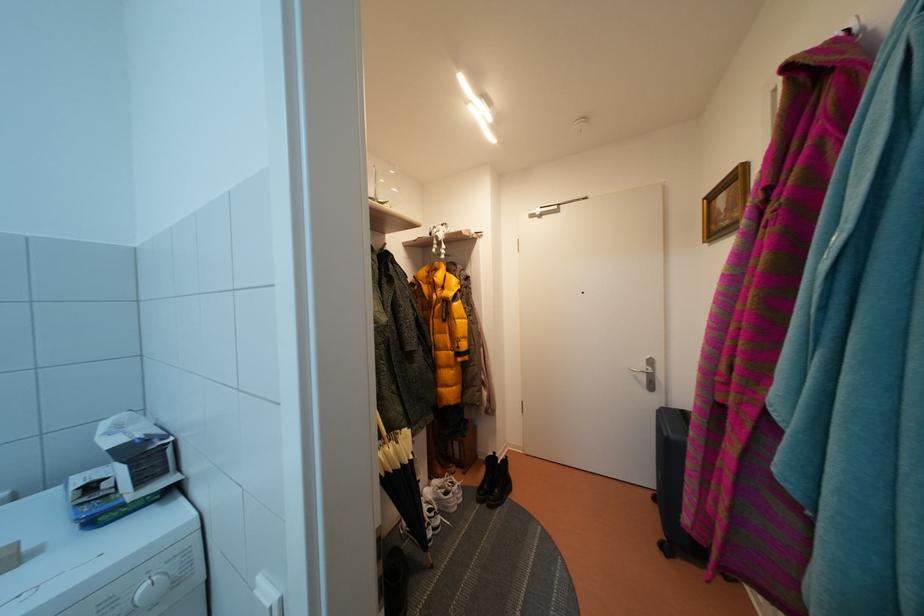
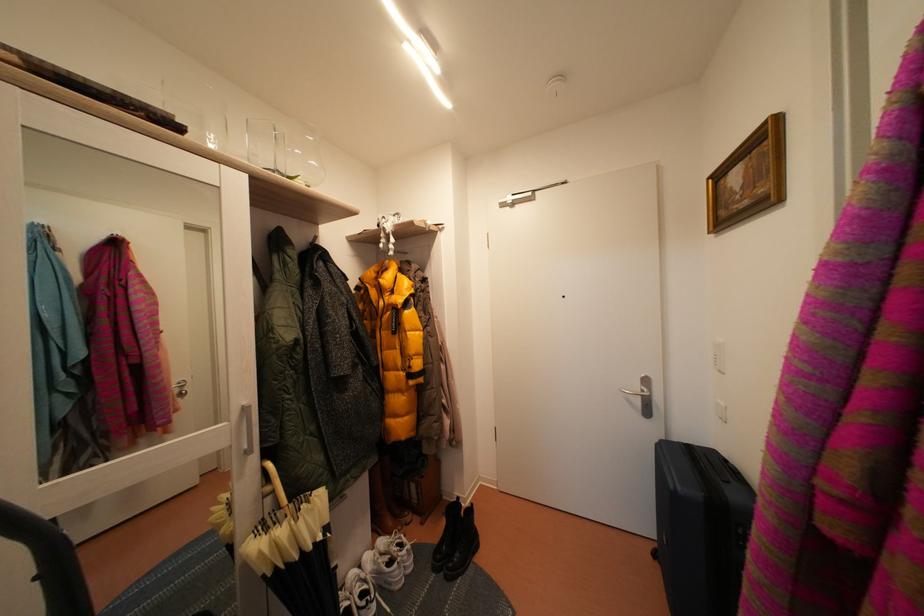
In a continuous first-person perspective shot, in which direction is the camera moving?

The movement direction of the cameraman is right, forward.